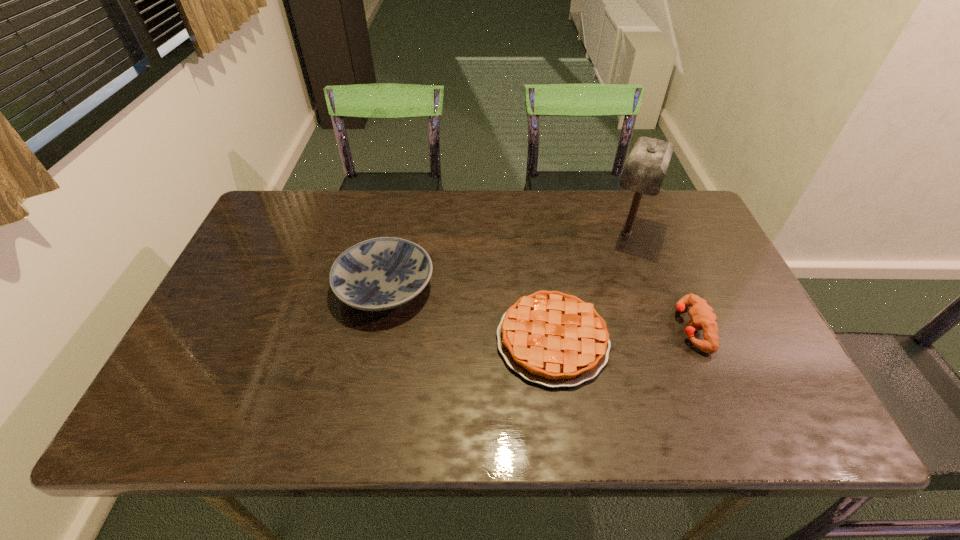
The width and height of the screenshot is (960, 540). Find the location of `free space located 0.310m on the right of the shortest object`. free space located 0.310m on the right of the shortest object is located at coordinates (738, 340).

This screenshot has height=540, width=960. What are the coordinates of `object positioned at the far edge` in the screenshot? It's located at (645, 169).

Where is `object positioned at the right edge`? object positioned at the right edge is located at coordinates (702, 315).

In the image, there is a desktop. At what (x,y) coordinates should I click in order to perform the action: click on vacant space at the far edge. Please return your answer as a coordinate pair (x, y). Looking at the image, I should click on (338, 202).

In the image, there is a desktop. Identify the location of vacant space at the near edge. The image size is (960, 540). (268, 421).

You are a GUI agent. You are given a task and a screenshot of the screen. Output one action in this format:
    pyautogui.click(x=<x>, y=<y>)
    Task: Click on the vacant space at the left edge of the desktop
    
    Given the screenshot: What is the action you would take?
    pyautogui.click(x=219, y=349)

In the image, there is a desktop. Where is `vacant space at the right edge`? Image resolution: width=960 pixels, height=540 pixels. vacant space at the right edge is located at coordinates (761, 387).

This screenshot has height=540, width=960. What are the coordinates of `vacant space at the far left corner of the desktop` in the screenshot? It's located at (268, 210).

Where is `vacant region at the near left corner of the desktop`? vacant region at the near left corner of the desktop is located at coordinates (165, 400).

Find the location of `vacant space at the far right corner of the desktop`. vacant space at the far right corner of the desktop is located at coordinates (695, 224).